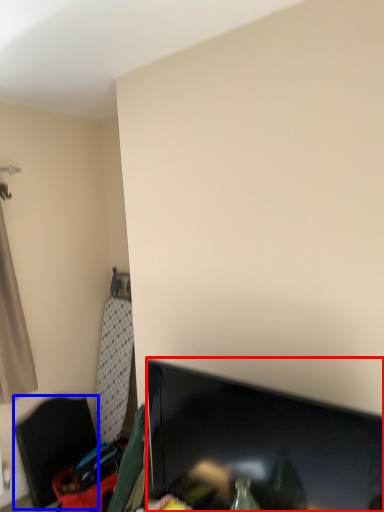
Question: Which object appears closest to the camera in this image, television (highlighted by a red box) or furniture (highlighted by a blue box)?

Choices:
 (A) television
 (B) furniture

Answer: (A)